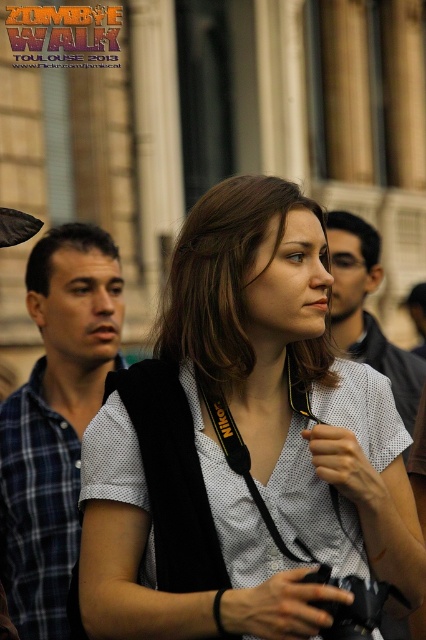
Who is more forward, (137,534) or (351,328)?

Positioned in front is point (137,534).

Is point (109, 448) positioned in front of point (354, 300)?

Yes, point (109, 448) is in front of point (354, 300).

This screenshot has height=640, width=426. Find the location of `white mesh shirt at center`. white mesh shirt at center is located at coordinates (244, 445).

Which is in front, point (187, 340) or point (83, 61)?

Point (187, 340)

Which of these two, matte white shirt at center or metallic text at upper left, stands taller?

Standing taller between the two is matte white shirt at center.

Is point (209, 388) more distant than point (74, 32)?

No.

Locate an element on the screen. This screenshot has height=640, width=426. matte white shirt at center is located at coordinates (221, 276).

Is matte black shirt at center positioned behind metallic text at upper left?

No, it is in front of metallic text at upper left.

Is point (339, 326) farther from viewer compared to point (5, 19)?

Yes, point (339, 326) is farther from viewer.

Between point (339, 349) and point (112, 13), which one is positioned behind?

The point (112, 13) is behind.

Find the location of `matte black shirt at center`. matte black shirt at center is located at coordinates (365, 310).